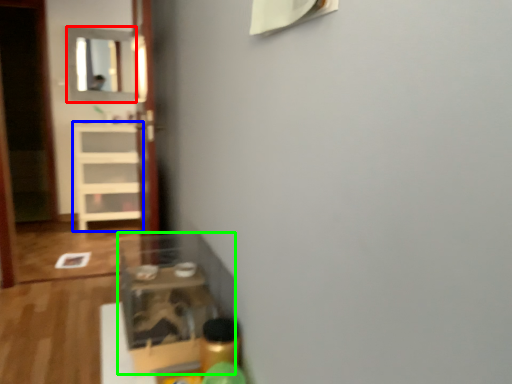
Question: Based on their relative distances, which object is nearer to mirror (highlighted by a red box)? Choose from shelf (highlighted by a blue box) and shelf (highlighted by a green box).

Choices:
 (A) shelf
 (B) shelf

Answer: (A)